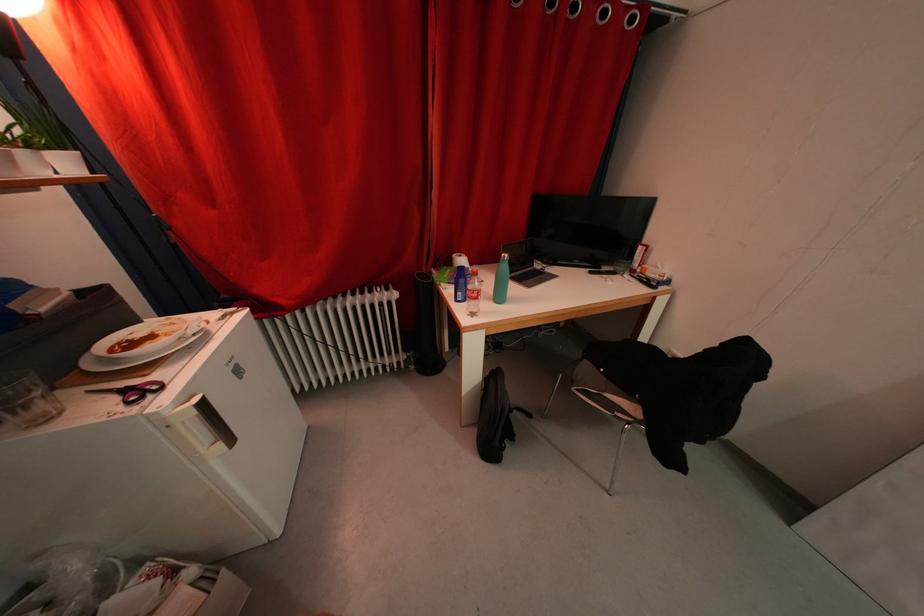
This screenshot has width=924, height=616. I want to click on black tower fan, so click(x=337, y=338).